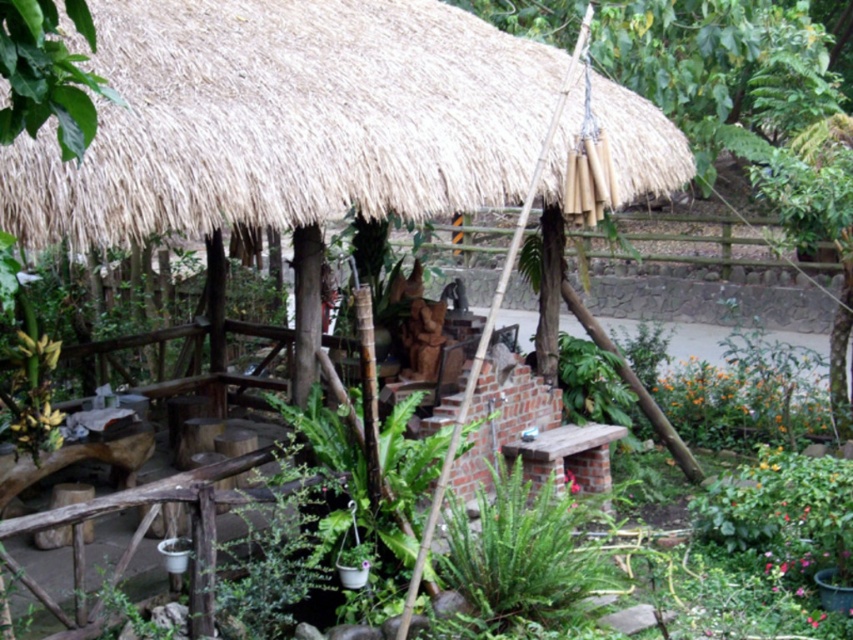
Who is higher up, natural thatch roof at upper center or green leafy plant at center?

natural thatch roof at upper center

Describe the element at coordinates (287, 120) in the screenshot. I see `natural thatch roof at upper center` at that location.

Locate an element on the screen. natural thatch roof at upper center is located at coordinates (287, 120).